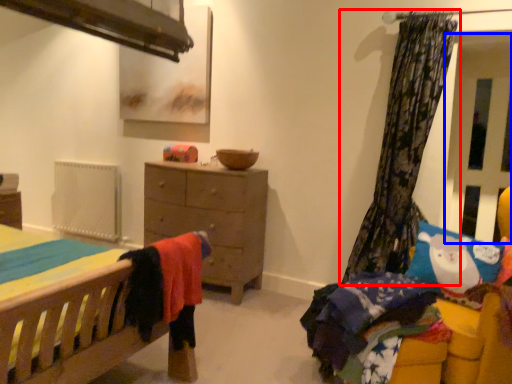
Question: Which object is further to the camera taking this photo, curtain (highlighted by a red box) or screen door (highlighted by a blue box)?

Choices:
 (A) curtain
 (B) screen door

Answer: (B)